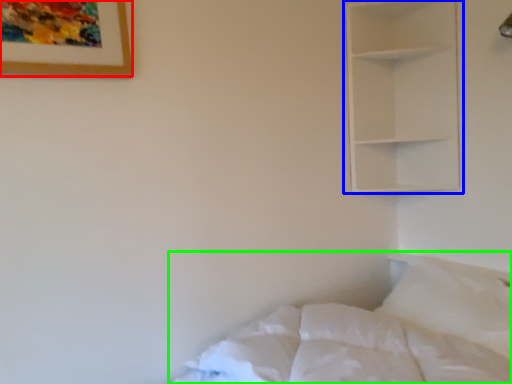
Question: Which object is positioned farthest from picture frame (highlighted by a red box)? Select from shelf (highlighted by a blue box) and bed (highlighted by a green box).

Choices:
 (A) shelf
 (B) bed

Answer: (A)